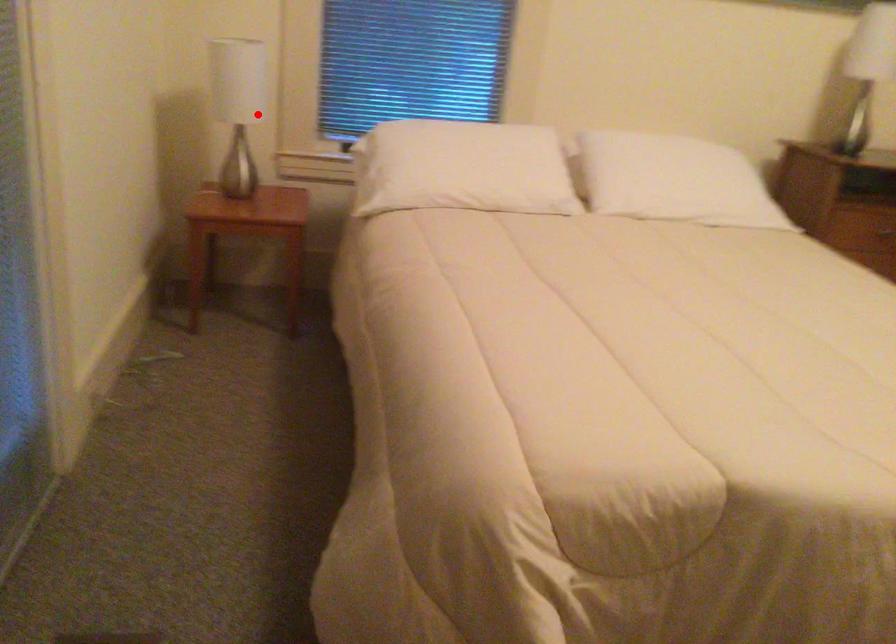
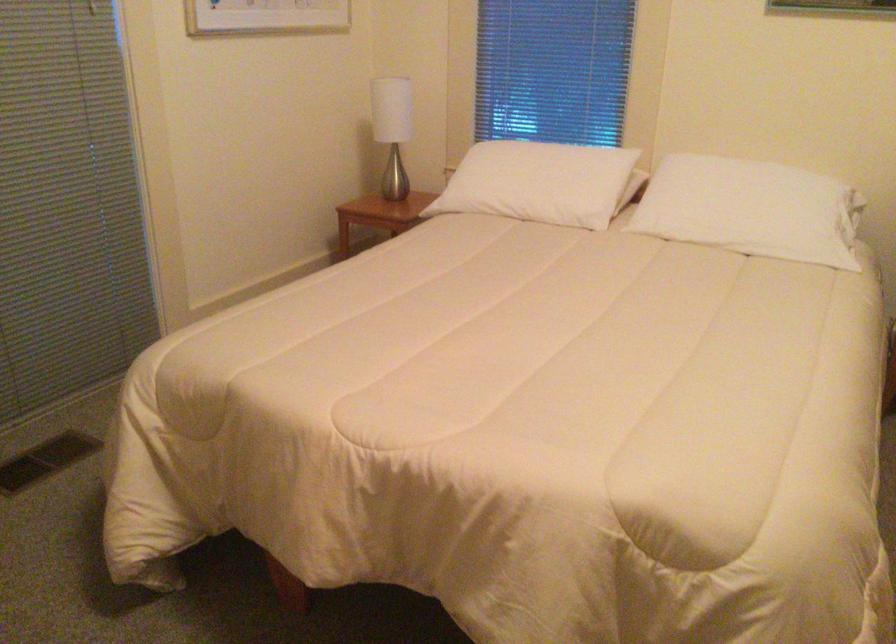
Question: A red point is marked in image1. In image2, is the corresponding 3D point closer to the camera or farther? Reply with the corresponding letter.

Choices:
 (A) The corresponding 3D point is closer.
 (B) The corresponding 3D point is farther.

Answer: (B)